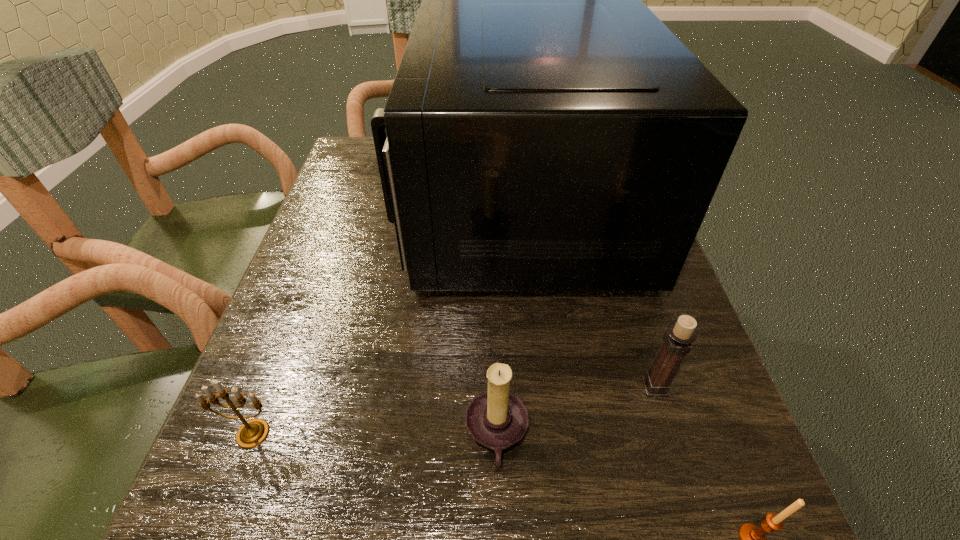
Find the location of a particular element. blank space located 0.230m on the wick of the third candle_holder from right to left is located at coordinates (299, 435).

At what (x,y) coordinates should I click in order to perform the action: click on vacant space located on the wick of the third candle_holder from right to left. Please return your answer as a coordinate pair (x, y). Image resolution: width=960 pixels, height=540 pixels. Looking at the image, I should click on pos(241,435).

This screenshot has width=960, height=540. I want to click on free space located 0.090m on the wick of the third candle_holder from right to left, so click(x=400, y=435).

The image size is (960, 540). Identify the location of vacant point located on the back of the leftmost object. (291, 334).

At what (x,y) coordinates should I click in order to perform the action: click on object situated at the far edge. Please return your answer as a coordinate pair (x, y). Image resolution: width=960 pixels, height=540 pixels. Looking at the image, I should click on (545, 131).

In order to click on object that is at the left edge in this screenshot , I will do `click(252, 433)`.

Find the location of a particular element. Image resolution: width=960 pixels, height=540 pixels. microwave_oven that is positioned at the right edge is located at coordinates (545, 131).

The image size is (960, 540). I want to click on candle holder that is positioned at the right edge, so click(677, 340).

The height and width of the screenshot is (540, 960). Find the location of `object positioned at the far right corner`. object positioned at the far right corner is located at coordinates (545, 131).

This screenshot has height=540, width=960. In the image, there is a desktop. Find the location of `free space at the left edge`. free space at the left edge is located at coordinates (369, 213).